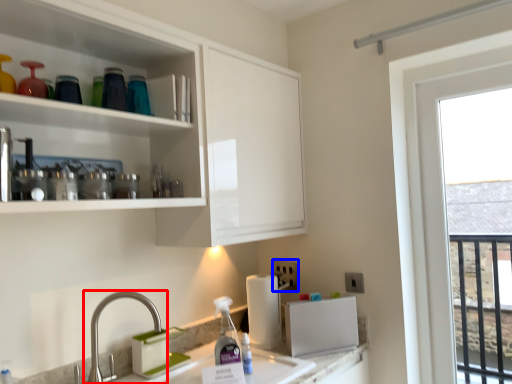
Question: Which of the following is the farthest to the observer, tap (highlighted by a red box) or electric outlet (highlighted by a blue box)?

Choices:
 (A) tap
 (B) electric outlet

Answer: (B)